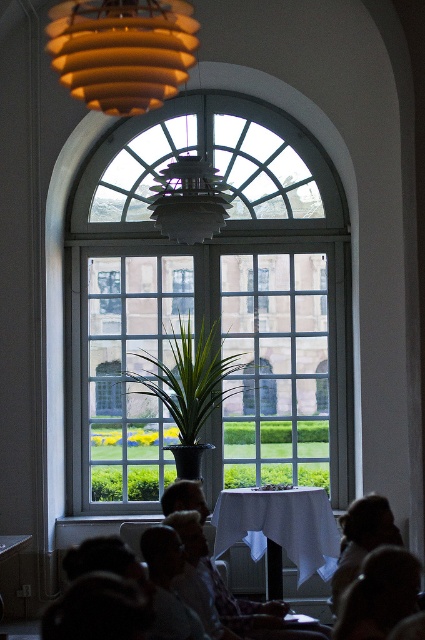
Question: Is clear glass window at center closer to the viewer compared to white cloth-covered table at center?

Choices:
 (A) no
 (B) yes

Answer: (A)

Question: Which object is the farthest from the silky brown hair at lower right?

Choices:
 (A) matte orange lampshade at upper center
 (B) clear glass window at center
 (C) white cloth-covered table at center

Answer: (B)

Question: Does white cloth-covered table at center come in front of silky brown hair at lower right?

Choices:
 (A) yes
 (B) no

Answer: (B)

Question: Which object is the closest to the matte orange lampshade at upper center?

Choices:
 (A) white cloth-covered table at center
 (B) dark hair at lower right
 (C) clear glass window at center

Answer: (B)

Question: Does white cloth-covered table at center have a smaller size compared to silky brown hair at lower right?

Choices:
 (A) yes
 (B) no

Answer: (B)

Question: Which point is farther from the camera taking this photo?

Choices:
 (A) (312, 352)
 (B) (363, 596)
 (C) (376, 547)

Answer: (A)